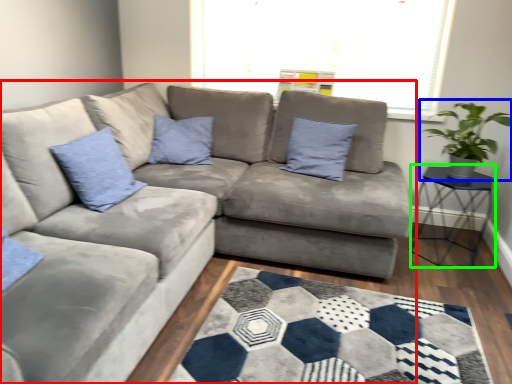
Question: Estimate the real-world distances between objects in this image. Which object is closer to studio couch (highlighted by a red box), houseplant (highlighted by a blue box) or table (highlighted by a green box)?

Choices:
 (A) houseplant
 (B) table

Answer: (B)